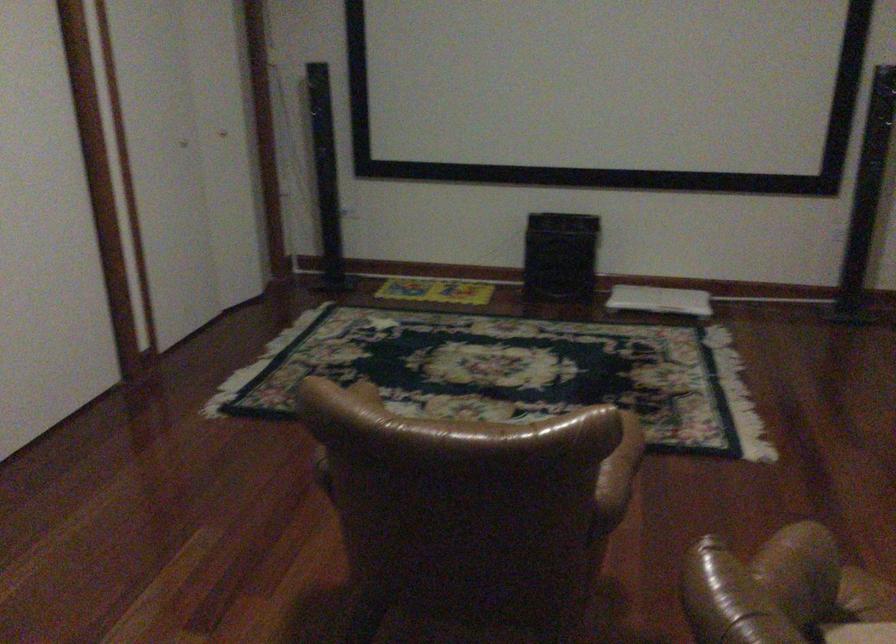
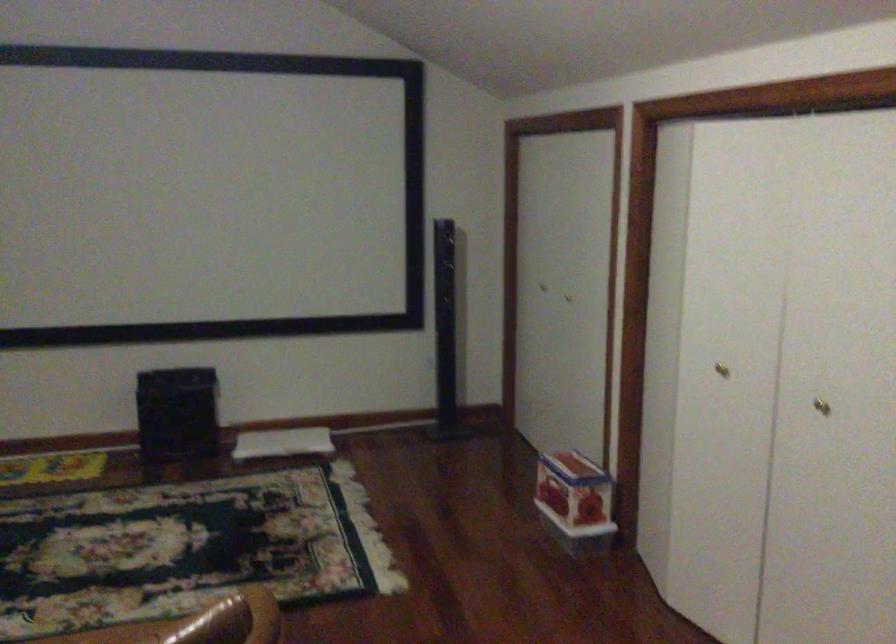
Which direction would the cameraman need to move to produce the second image?

The cameraman moved toward left, backward.